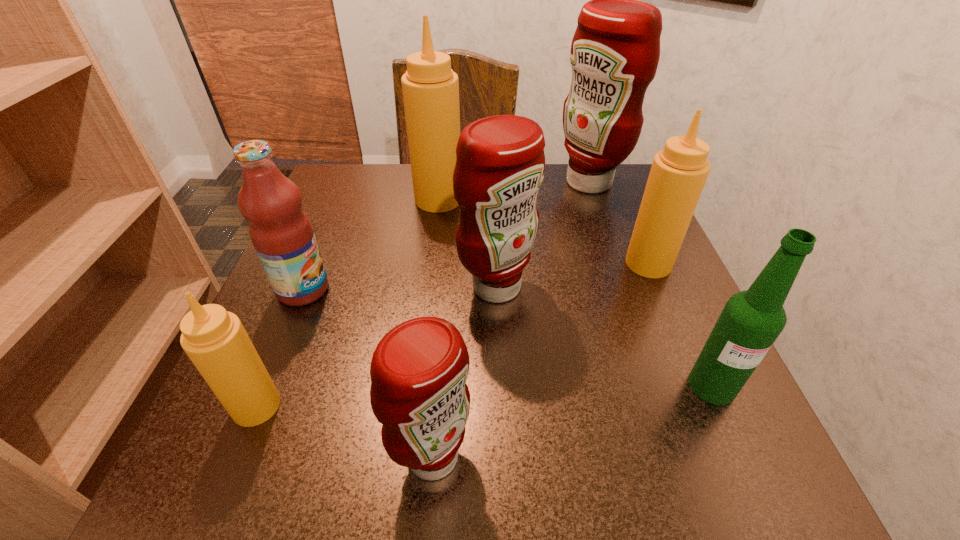
At what (x,y) coordinates should I click in order to perform the action: click on vacant area between the smallest red condiment and the leftmost condiment. Please return your answer as a coordinate pair (x, y). Looking at the image, I should click on (345, 431).

Where is `vacant area between the rightmost red condiment and the beer bottle`? Image resolution: width=960 pixels, height=540 pixels. vacant area between the rightmost red condiment and the beer bottle is located at coordinates (651, 284).

At what (x,y) coordinates should I click in order to perform the action: click on free space between the green beer bottle and the fruit juice. Please return your answer as a coordinate pair (x, y). Looking at the image, I should click on (508, 338).

Identify the location of empty space between the second smallest red condiment and the fruit juice. (399, 288).

The width and height of the screenshot is (960, 540). I want to click on free point between the leftmost tan condiment and the farthest tan condiment, so click(x=348, y=303).

Locate an element on the screen. Image resolution: width=960 pixels, height=540 pixels. vacant space that is in between the second farthest tan condiment and the beer bottle is located at coordinates (681, 325).

Locate an element on the screen. This screenshot has height=540, width=960. free spot between the farthest red condiment and the fruit juice is located at coordinates [446, 236].

I want to click on free point between the green beer bottle and the smallest red condiment, so click(x=573, y=421).

The width and height of the screenshot is (960, 540). Find the location of `the sixth closest object to the rightmost red condiment`. the sixth closest object to the rightmost red condiment is located at coordinates (419, 369).

Identify which object is the third nearest to the leftmost condiment. Please provide its 2D coordinates. Your answer should be formatted as a tuple, i.e. [(x, y)], where the tuple contains the x and y coordinates of a point satisfying the conditions above.

[(500, 164)]